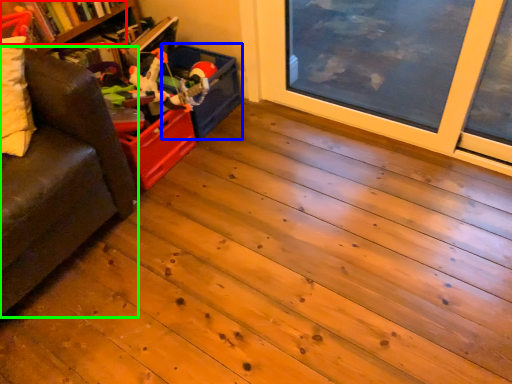
Question: Which object is positioned closest to book (highlighted by a red box)? Select from storage box (highlighted by a blue box) and studio couch (highlighted by a green box).

Choices:
 (A) storage box
 (B) studio couch

Answer: (A)